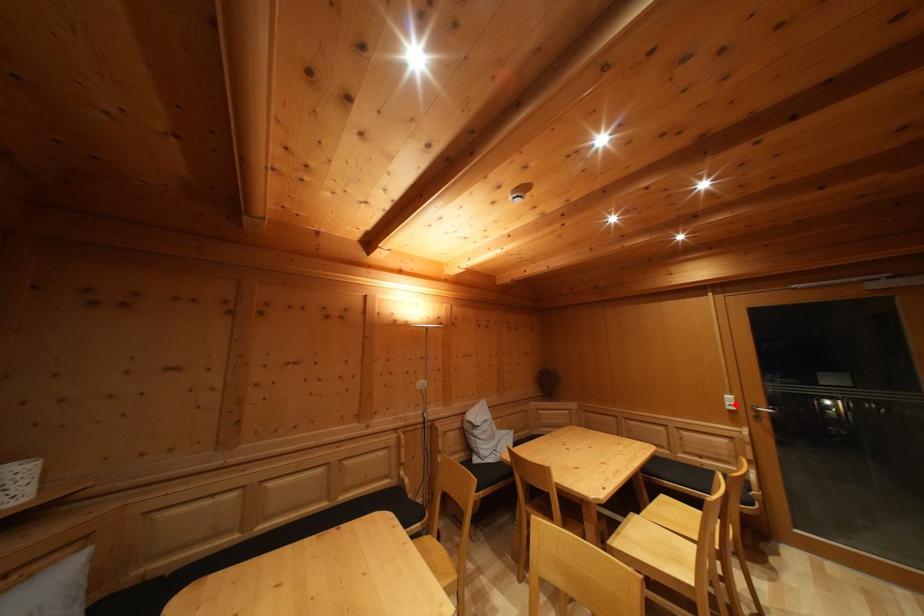
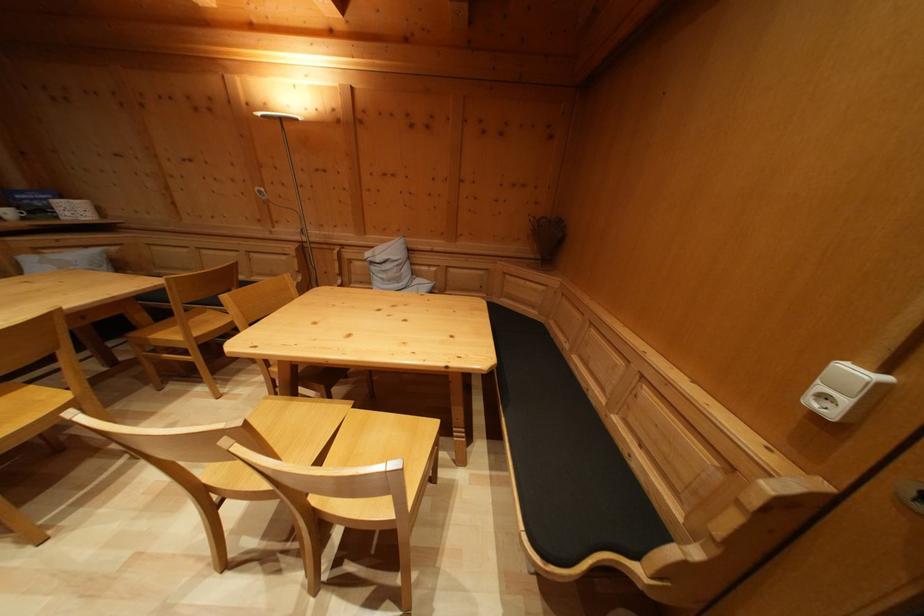
In the second image, find the point that corresponds to the highlighted location in the first image.

(859, 379)